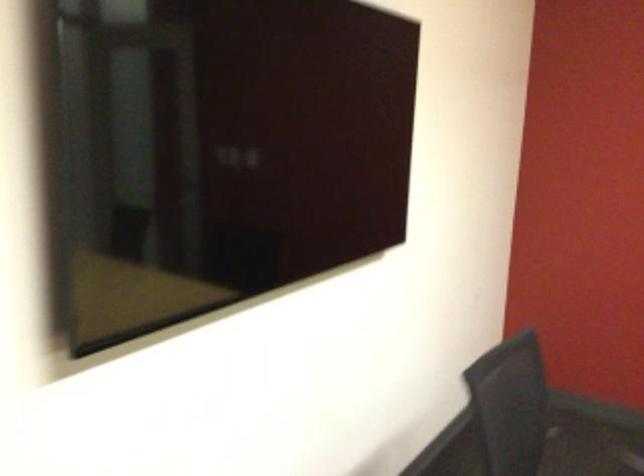
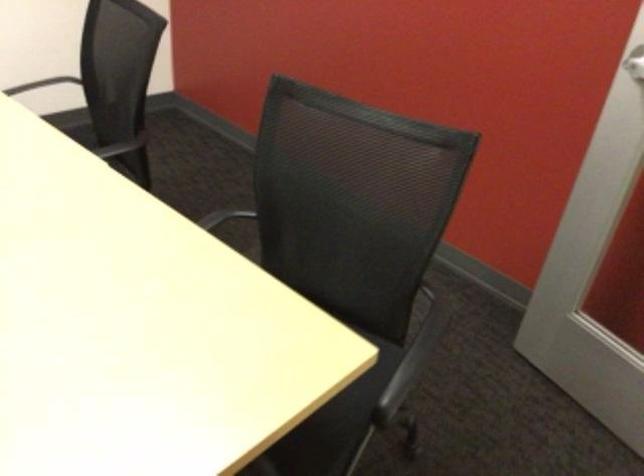
Question: Which direction would the cameraman need to move to produce the second image? Reply with the corresponding letter.

Choices:
 (A) Left
 (B) Right
 (C) Forward
 (D) Backward

Answer: (B)